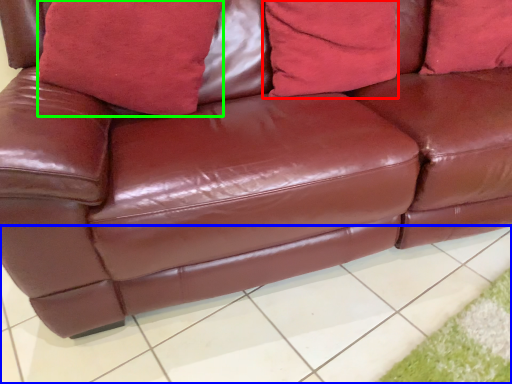
Question: Which object is the closest to the pillow (highlighted by a red box)? Choose among these: tile (highlighted by a blue box) or pillow (highlighted by a green box).

Choices:
 (A) tile
 (B) pillow

Answer: (B)